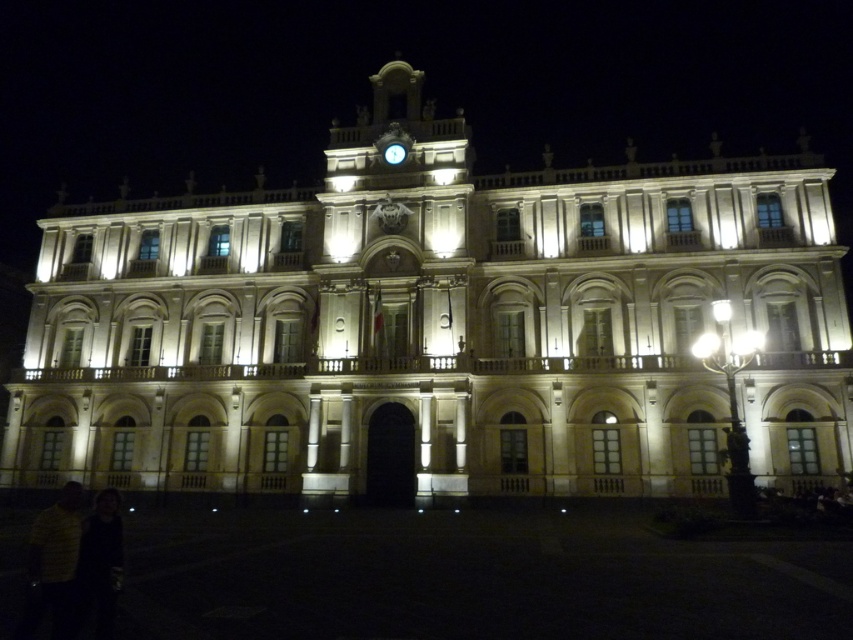
Question: Is beige stone building at center thinner than metallic clock at upper center?

Choices:
 (A) yes
 (B) no

Answer: (B)

Question: Among these points, which one is farthest from the camera?

Choices:
 (A) (592, 381)
 (B) (392, 144)

Answer: (B)

Question: Can you confirm if beige stone building at center is positioned to the right of metallic clock at upper center?

Choices:
 (A) yes
 (B) no

Answer: (B)

Question: Is beige stone building at center behind metallic clock at upper center?

Choices:
 (A) yes
 (B) no

Answer: (B)